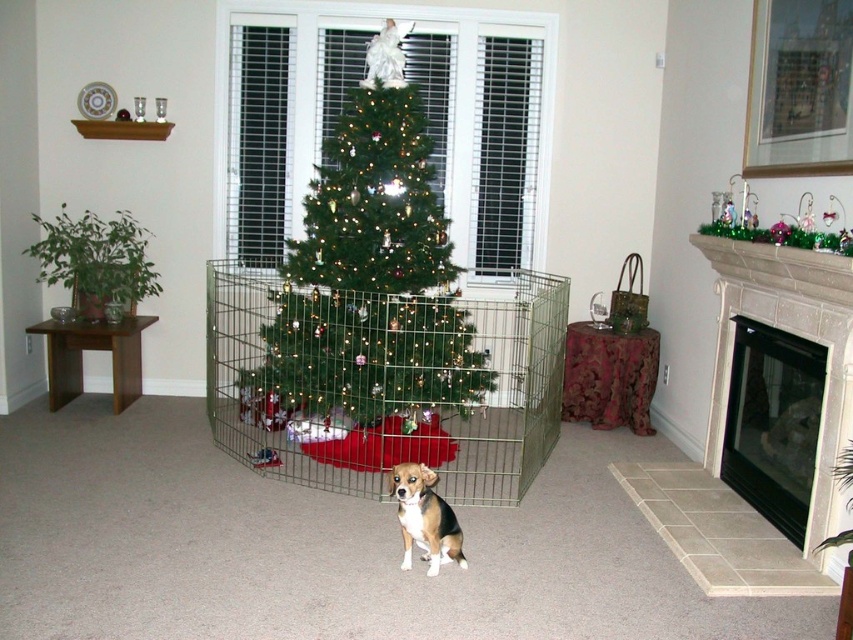
Is metallic wire cage at center to the right of green matte christmas tree at center from the viewer's perspective?

In fact, metallic wire cage at center is to the left of green matte christmas tree at center.

Find the location of `metallic wire cage at center`. metallic wire cage at center is located at coordinates (386, 381).

Locate an element on the screen. metallic wire cage at center is located at coordinates (386, 381).

Between point (230, 371) and point (457, 536), which one is positioned behind?

Point (230, 371)

Can you confirm if metallic wire cage at center is wider than brown and white fur dog at center?

Yes.

Is point (395, 381) behind point (415, 541)?

That is True.

At what (x,y) coordinates should I click in order to perform the action: click on metallic wire cage at center. Please return your answer as a coordinate pair (x, y). The height and width of the screenshot is (640, 853). Looking at the image, I should click on (386, 381).

What do you see at coordinates (372, 269) in the screenshot? I see `green matte christmas tree at center` at bounding box center [372, 269].

The image size is (853, 640). Describe the element at coordinates (372, 269) in the screenshot. I see `green matte christmas tree at center` at that location.

Identify the location of green matte christmas tree at center. (372, 269).